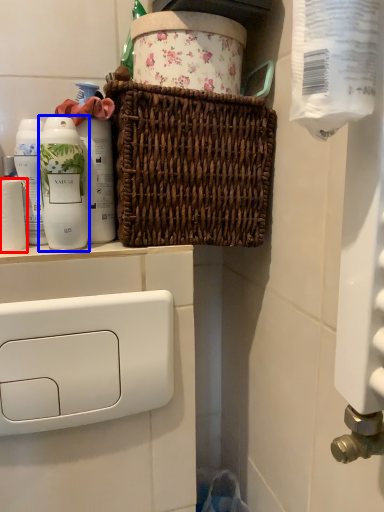
Question: Which object is further to the camera taking this photo, toilet paper (highlighted by a red box) or bottle (highlighted by a blue box)?

Choices:
 (A) toilet paper
 (B) bottle

Answer: (A)